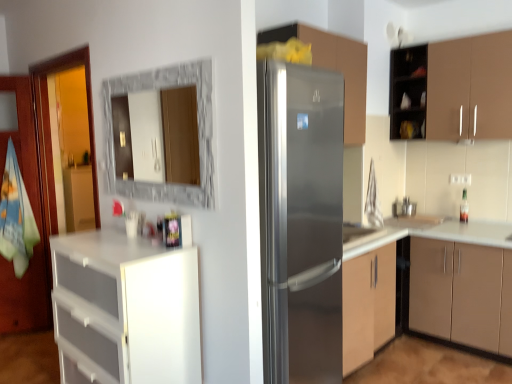
Question: Is satin silver refrigerator at center, which is the third cabinetry in right-to-left order, located outside stainless steel refrigerator at center?

Choices:
 (A) yes
 (B) no

Answer: (A)

Question: Is the position of satin silver refrigerator at center, which is the 2th cabinetry in left-to-right order, more distant than that of stainless steel refrigerator at center?

Choices:
 (A) no
 (B) yes

Answer: (B)

Question: Considering the relative sizes of satin silver refrigerator at center, which is the 2th cabinetry in left-to-right order, and stainless steel refrigerator at center in the image provided, is satin silver refrigerator at center, which is the 2th cabinetry in left-to-right order, thinner than stainless steel refrigerator at center?

Choices:
 (A) no
 (B) yes

Answer: (B)

Question: Is satin silver refrigerator at center, which is the third cabinetry in right-to-left order, far from stainless steel refrigerator at center?

Choices:
 (A) no
 (B) yes

Answer: (A)

Question: From a real-world perspective, is satin silver refrigerator at center, which is the third cabinetry in right-to-left order, physically below stainless steel refrigerator at center?

Choices:
 (A) no
 (B) yes

Answer: (A)

Question: Is satin silver sink at center wider or thinner than stainless steel refrigerator at center?

Choices:
 (A) wide
 (B) thin

Answer: (B)

Question: Considering the positions of point (368, 231) and point (309, 253), is point (368, 231) closer or farther from the camera than point (309, 253)?

Choices:
 (A) closer
 (B) farther

Answer: (B)

Question: Based on their sizes in the image, would you say satin silver sink at center is bigger or smaller than stainless steel refrigerator at center?

Choices:
 (A) small
 (B) big

Answer: (A)

Question: Do you think satin silver sink at center is within stainless steel refrigerator at center, or outside of it?

Choices:
 (A) outside
 (B) inside

Answer: (A)

Question: Is stainless steel refrigerator at center inside or outside of marble frame mirror at upper center?

Choices:
 (A) inside
 (B) outside

Answer: (B)

Question: Relative to marble frame mirror at upper center, is stainless steel refrigerator at center in front or behind?

Choices:
 (A) front
 (B) behind

Answer: (A)

Question: Would you say stainless steel refrigerator at center is to the left or to the right of marble frame mirror at upper center in the picture?

Choices:
 (A) right
 (B) left

Answer: (A)

Question: From the image's perspective, relative to marble frame mirror at upper center, is stainless steel refrigerator at center above or below?

Choices:
 (A) below
 (B) above

Answer: (A)

Question: Is point (286, 26) positioned closer to the camera than point (359, 231)?

Choices:
 (A) closer
 (B) farther

Answer: (A)

Question: Considering the positions of satin silver refrigerator at center, which is the third cabinetry in right-to-left order, and satin silver sink at center in the image, is satin silver refrigerator at center, which is the third cabinetry in right-to-left order, wider or thinner than satin silver sink at center?

Choices:
 (A) thin
 (B) wide

Answer: (A)